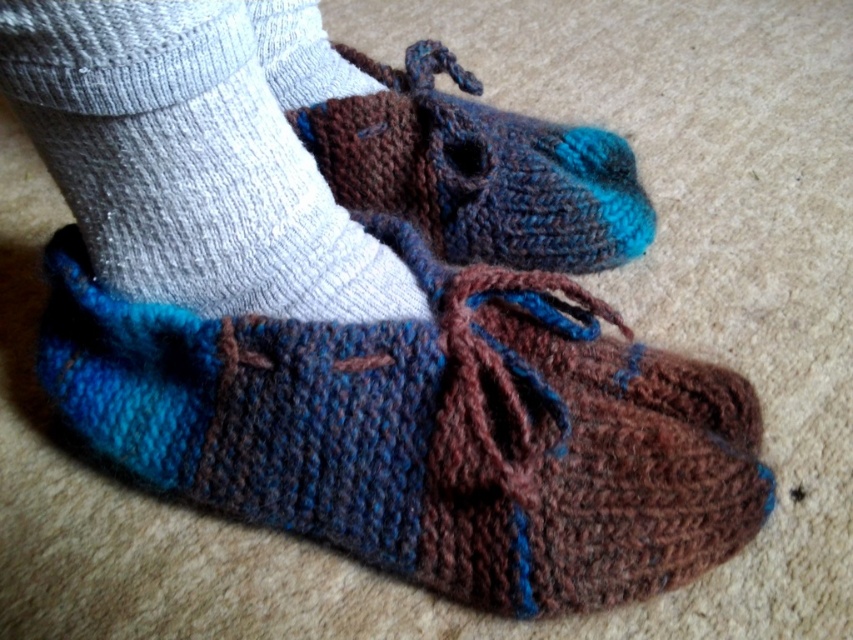
Question: Which point is closer to the camera taking this photo?

Choices:
 (A) (227, 52)
 (B) (758, 515)
 (C) (578, 161)

Answer: (A)

Question: Which object is closer to the camera taking this photo?

Choices:
 (A) blue knitted moccasin at center
 (B) knitted wool sock at lower left

Answer: (B)

Question: Is knitted wool sock at lower left closer to the viewer compared to knitted woolen moccasin at center?

Choices:
 (A) yes
 (B) no

Answer: (A)

Question: Can you confirm if knitted wool sock at lower left is positioned below knitted woolen moccasin at center?

Choices:
 (A) no
 (B) yes

Answer: (B)

Question: Considering the real-world distances, which object is farthest from the knitted woolen moccasin at center?

Choices:
 (A) knitted wool sock at lower left
 (B) blue knitted moccasin at center

Answer: (A)

Question: Does knitted wool sock at lower left appear under knitted woolen moccasin at center?

Choices:
 (A) no
 (B) yes

Answer: (B)